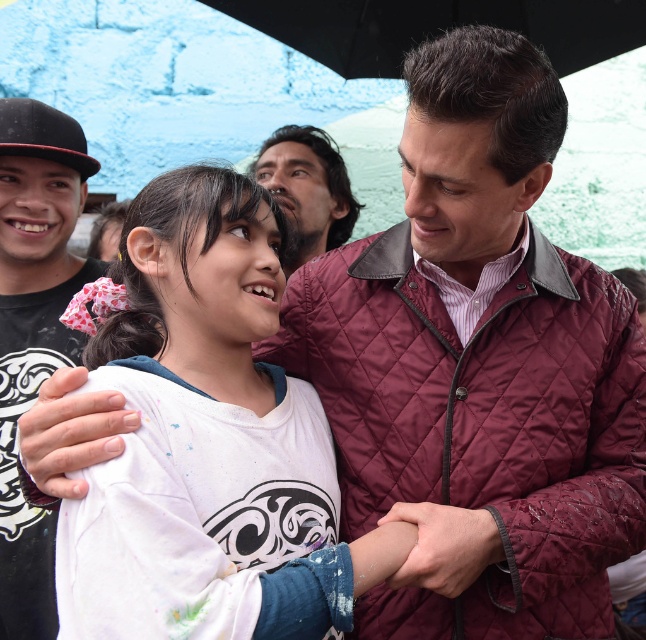
You are a photographer at a family gathering. You need to ensure that both the white cotton shirt at center and the black quilted jacket at left are visible in your photo. Given their sizes, which one might you need to position closer to the camera to ensure both appear equally sized in the final image?

The white cotton shirt at center is larger in size compared to the black quilted jacket at left. To make both appear equally sized in the photo, you should position the black quilted jacket at left closer to the camera since it is smaller in size.

You are an observer in the scene described. You notice the black quilted jacket at left and the dark brown hair at upper center. Which object occupies more horizontal space in the image?

The dark brown hair at upper center occupies more horizontal space than the black quilted jacket at left.